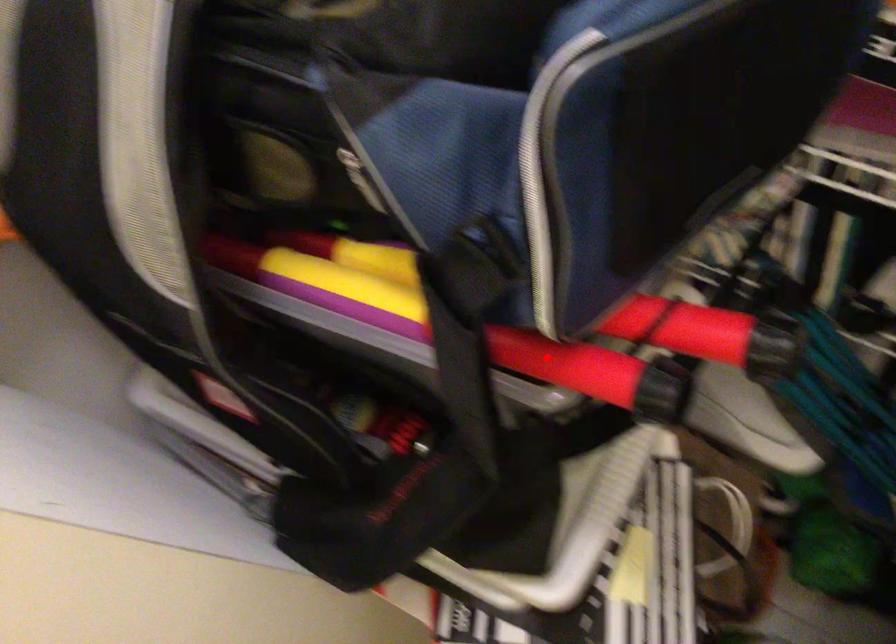
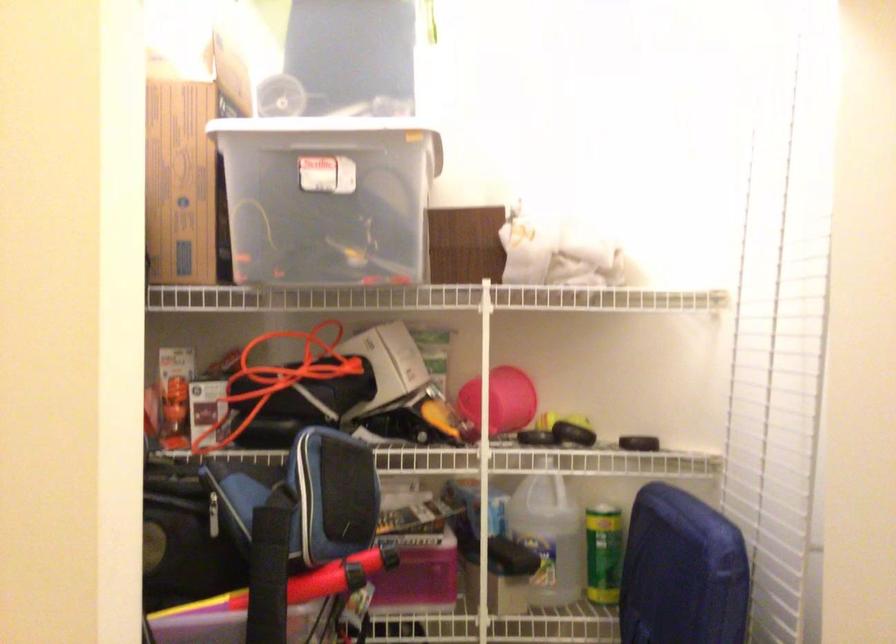
Question: I am providing you with two images of the same scene from different viewpoints. Given a red point in image1, look at the same physical point in image2. Is it:

Choices:
 (A) Closer to the viewpoint
 (B) Farther from the viewpoint

Answer: (B)